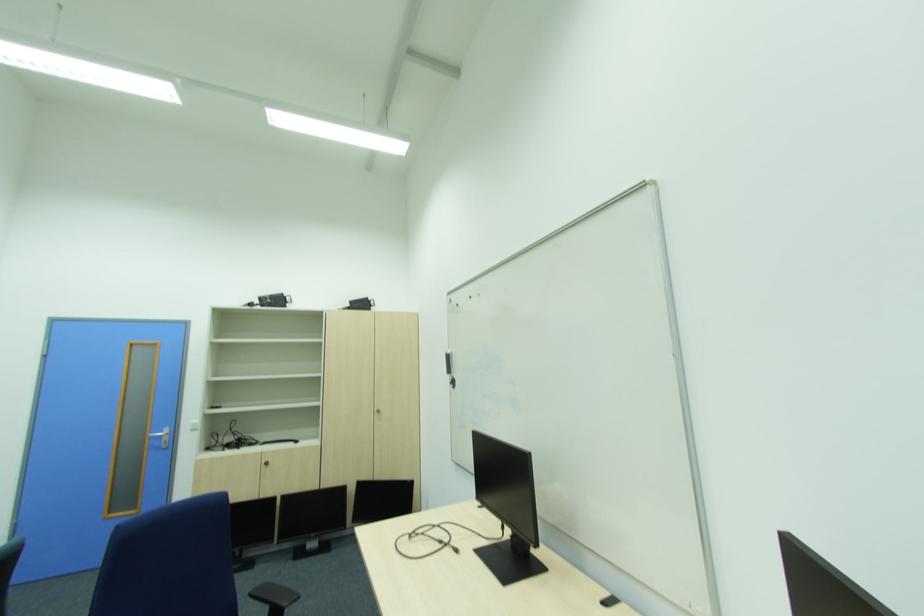
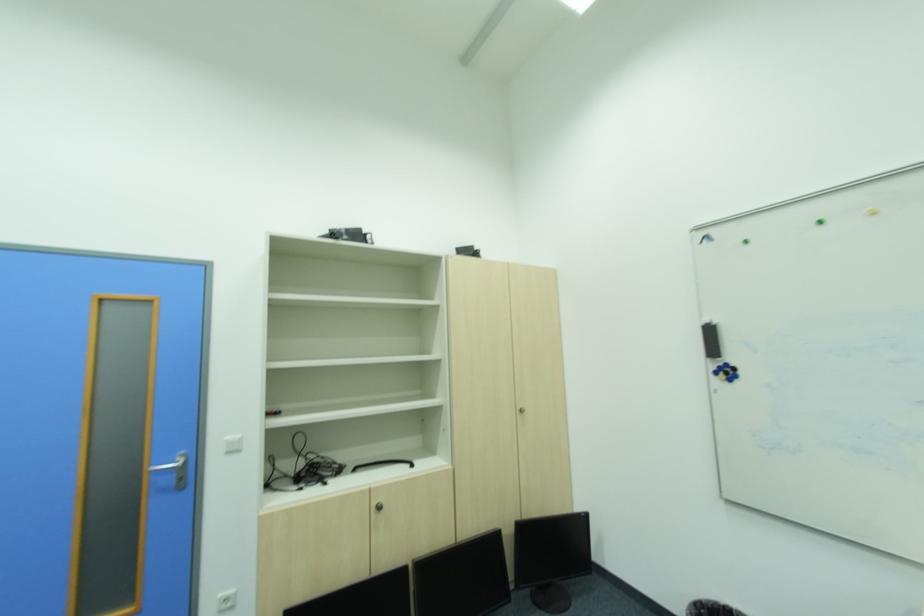
In the second image, find the point that corresponds to point (201, 424) in the first image.

(237, 443)